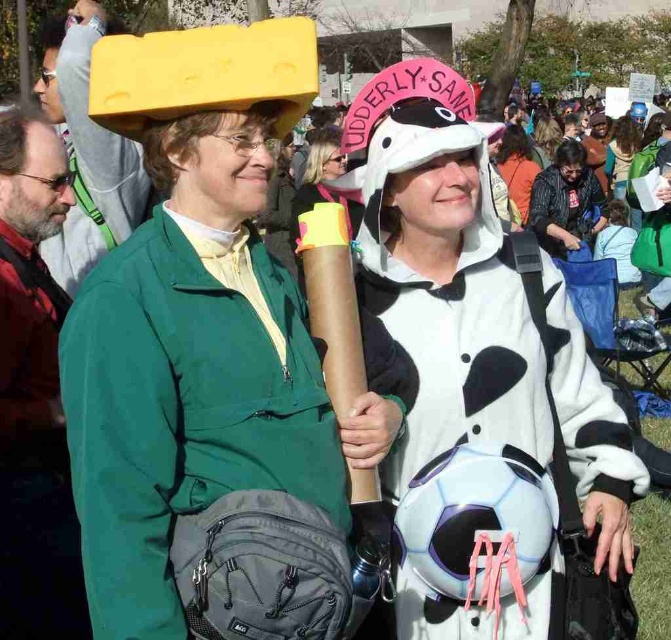
You are a photographer trying to capture the best shot of the white plush hat at center and the matte black backpack at center. Since you want to highlight both items clearly, which one should you focus on first to ensure sharpness?

The white plush hat at center is closer to the viewer than the matte black backpack at center, so you should focus on the white plush hat at center first to ensure both are in focus.